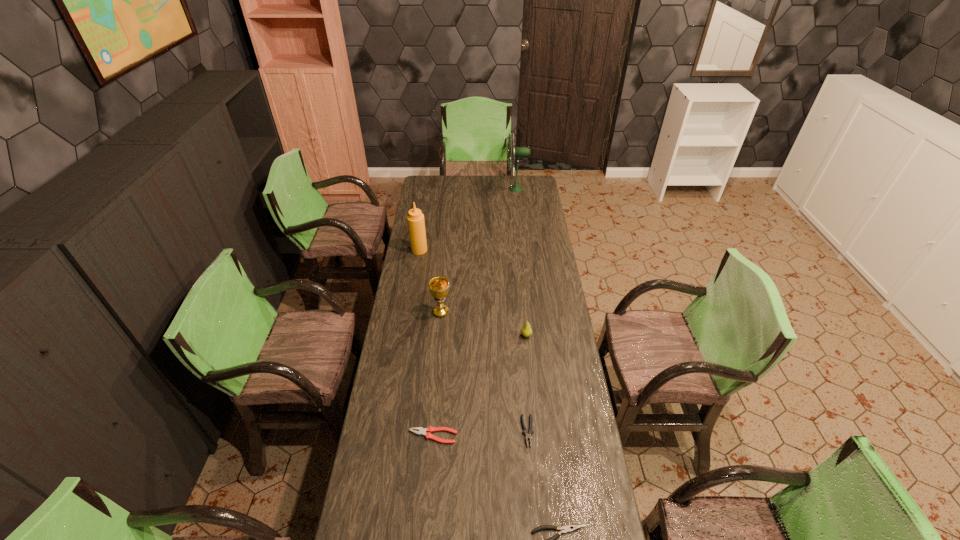
Locate which object ranks second in proximity to the fourth tallest object. Please provide its 2D coordinates. Your answer should be formatted as a tuple, i.e. [(x, y)], where the tuple contains the x and y coordinates of a point satisfying the conditions above.

[(528, 434)]

Where is `pliers that is the second closest one to the condiment`? Image resolution: width=960 pixels, height=540 pixels. pliers that is the second closest one to the condiment is located at coordinates (528, 434).

Identify which pliers is the third nearest to the leftmost object. Please provide its 2D coordinates. Your answer should be formatted as a tuple, i.e. [(x, y)], where the tuple contains the x and y coordinates of a point satisfying the conditions above.

[(572, 527)]

Locate an element on the screen. vacant area in the image that satisfies the following two spatial constraints: 1. on the back side of the leftmost pliers; 2. on the right side of the fourth shortest object is located at coordinates (442, 336).